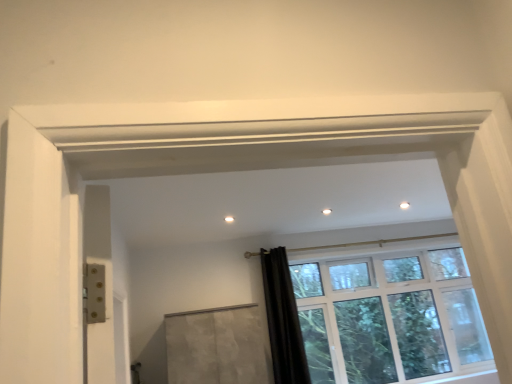
Image resolution: width=512 pixels, height=384 pixels. Find the location of `clear glass window at center`. clear glass window at center is located at coordinates (390, 313).

Is black velvet curtain at lower right not near matte concrete screen door at center?

No, black velvet curtain at lower right is not far from matte concrete screen door at center.

From the image's perspective, would you say black velvet curtain at lower right is shown under matte concrete screen door at center?

No, from the image's perspective, black velvet curtain at lower right is not beneath matte concrete screen door at center.

Who is smaller, black velvet curtain at lower right or matte concrete screen door at center?

black velvet curtain at lower right is smaller.

Would you say matte concrete screen door at center contains black velvet curtain at lower right?

No.

In the scene shown: Can you tell me how much matte concrete screen door at center and black velvet curtain at lower right differ in facing direction?

There is a 4.67-degree angle between the facing directions of matte concrete screen door at center and black velvet curtain at lower right.

Is matte concrete screen door at center not close to black velvet curtain at lower right?

No.

Is matte concrete screen door at center wider or thinner than black velvet curtain at lower right?

Considering their sizes, matte concrete screen door at center looks broader than black velvet curtain at lower right.

Which point is more forward, (334, 332) or (193, 355)?

The point (193, 355) is closer.

From a real-world perspective, who is located higher, clear glass window at center or matte concrete screen door at center?

In real-world perspective, clear glass window at center is above.

Is clear glass window at center surrounding matte concrete screen door at center?

Definitely not — matte concrete screen door at center is not inside clear glass window at center.

Considering the relative positions of clear glass window at center and matte concrete screen door at center in the image provided, is clear glass window at center to the left or to the right of matte concrete screen door at center?

In the image, clear glass window at center appears on the right side of matte concrete screen door at center.

From a real-world perspective, does clear glass window at center sit lower than black velvet curtain at lower right?

Yes, from a real-world perspective, clear glass window at center is under black velvet curtain at lower right.

Considering the relative sizes of clear glass window at center and black velvet curtain at lower right in the image provided, is clear glass window at center shorter than black velvet curtain at lower right?

Incorrect, the height of clear glass window at center does not fall short of that of black velvet curtain at lower right.

From the image's perspective, would you say clear glass window at center is positioned over black velvet curtain at lower right?

Incorrect, from the image's perspective, clear glass window at center is lower than black velvet curtain at lower right.

Who is smaller, clear glass window at center or black velvet curtain at lower right?

Smaller between the two is black velvet curtain at lower right.

Between black velvet curtain at lower right and clear glass window at center, which one has larger width?

clear glass window at center.

Is black velvet curtain at lower right looking in the opposite direction of clear glass window at center?

No, black velvet curtain at lower right's orientation is not away from clear glass window at center.

How different are the orientations of black velvet curtain at lower right and clear glass window at center in degrees?

The angle between the facing direction of black velvet curtain at lower right and the facing direction of clear glass window at center is 2.87 degrees.

How many degrees apart are the facing directions of matte concrete screen door at center and clear glass window at center?

The facing directions of matte concrete screen door at center and clear glass window at center are 1.8 degrees apart.

Is clear glass window at center a part of matte concrete screen door at center?

No, matte concrete screen door at center does not contain clear glass window at center.

Does point (241, 316) come farther from viewer compared to point (466, 274)?

No.

From the picture: Which of these two, matte concrete screen door at center or clear glass window at center, is wider?

With larger width is matte concrete screen door at center.

Where is `shower curtain located above the matte concrete screen door at center (from a real-world perspective)`? This screenshot has width=512, height=384. shower curtain located above the matte concrete screen door at center (from a real-world perspective) is located at coordinates (283, 319).

Identify the location of shower curtain behind the matte concrete screen door at center. The height and width of the screenshot is (384, 512). (283, 319).

From the image, which object appears to be nearer to matte concrete screen door at center, clear glass window at center or black velvet curtain at lower right?

black velvet curtain at lower right is positioned closer to the anchor matte concrete screen door at center.

From the image, which object appears to be nearer to clear glass window at center, black velvet curtain at lower right or matte concrete screen door at center?

black velvet curtain at lower right is closer to clear glass window at center.

Considering their positions, is clear glass window at center positioned closer to black velvet curtain at lower right than matte concrete screen door at center?

matte concrete screen door at center is closer to black velvet curtain at lower right.

Looking at the image, which one is located closer to black velvet curtain at lower right, matte concrete screen door at center or clear glass window at center?

matte concrete screen door at center lies closer to black velvet curtain at lower right than the other object.

Based on their spatial positions, is matte concrete screen door at center or black velvet curtain at lower right further from clear glass window at center?

matte concrete screen door at center lies further to clear glass window at center than the other object.

Looking at the image, which one is located closer to matte concrete screen door at center, black velvet curtain at lower right or clear glass window at center?

Based on the image, black velvet curtain at lower right appears to be nearer to matte concrete screen door at center.

Find the location of a particular element. This screenshot has width=512, height=384. shower curtain between matte concrete screen door at center and clear glass window at center from left to right is located at coordinates (283, 319).